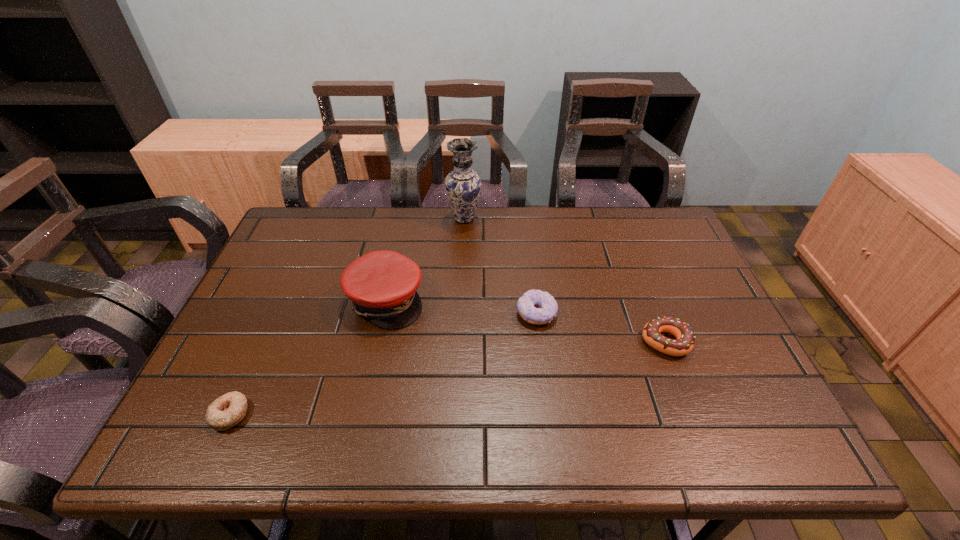
This screenshot has height=540, width=960. In the image, there is a desktop. In order to click on free space at the left edge in this screenshot , I will do `click(258, 391)`.

In the image, there is a desktop. In order to click on free space at the right edge in this screenshot , I will do `click(680, 302)`.

At what (x,y) coordinates should I click in order to perform the action: click on vacant space at the near left corner of the desktop. Please return your answer as a coordinate pair (x, y). The image size is (960, 540). Looking at the image, I should click on (200, 441).

Locate an element on the screen. Image resolution: width=960 pixels, height=540 pixels. vacant space at the far right corner of the desktop is located at coordinates (664, 214).

Find the location of a particular element. The image size is (960, 540). vacant space that is in between the rightmost object and the tallest object is located at coordinates (564, 280).

The height and width of the screenshot is (540, 960). I want to click on vacant area that lies between the second object from left to right and the second object from right to left, so click(x=461, y=307).

You are a GUI agent. You are given a task and a screenshot of the screen. Output one action in this format:
    pyautogui.click(x=<x>, y=<y>)
    Task: Click on the blank region between the second object from left to right and the second object from right to left
    
    Given the screenshot: What is the action you would take?
    pyautogui.click(x=461, y=307)

You are a GUI agent. You are given a task and a screenshot of the screen. Output one action in this format:
    pyautogui.click(x=<x>, y=<y>)
    Task: Click on the vacant space that is in between the farthest object and the second object from left to right
    The image size is (960, 540).
    Given the screenshot: What is the action you would take?
    pyautogui.click(x=425, y=260)

Where is `free space between the cap and the farthest object`? free space between the cap and the farthest object is located at coordinates (425, 260).

Where is `free point between the tallest object and the cap`? The height and width of the screenshot is (540, 960). free point between the tallest object and the cap is located at coordinates (425, 260).